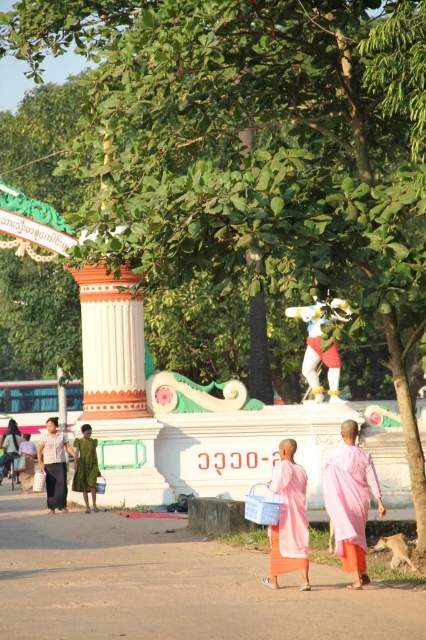
Who is more forward, (55, 465) or (77, 467)?

Point (77, 467) is in front.

Does pink cotton robe at center appear over green matte dress at center?

Yes.

Find the location of a particular element. The height and width of the screenshot is (640, 426). pink cotton robe at center is located at coordinates (54, 465).

Between pink silk robe at lower right and green matte dress at center, which one has less height?

green matte dress at center is shorter.

Who is positioned more to the right, pink silk robe at lower right or green matte dress at center?

pink silk robe at lower right is more to the right.

What do you see at coordinates (350, 500) in the screenshot? The width and height of the screenshot is (426, 640). I see `pink silk robe at lower right` at bounding box center [350, 500].

The image size is (426, 640). Identify the location of pink silk robe at lower right. (350, 500).

Measure the distance from pink silk robe at center to pink cotton robe at center.

pink silk robe at center is 30.78 meters away from pink cotton robe at center.

Between pink silk robe at center and pink cotton robe at center, which one has more height?

pink cotton robe at center

Between point (271, 573) and point (57, 458), which one is positioned in front?

Positioned in front is point (271, 573).

Locate an element on the screen. The height and width of the screenshot is (640, 426). pink silk robe at center is located at coordinates (288, 518).